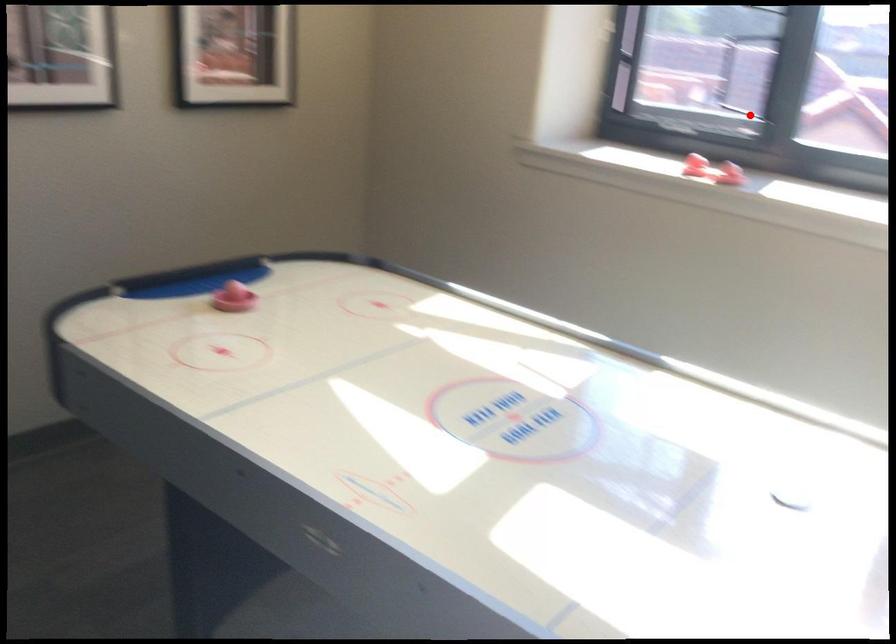
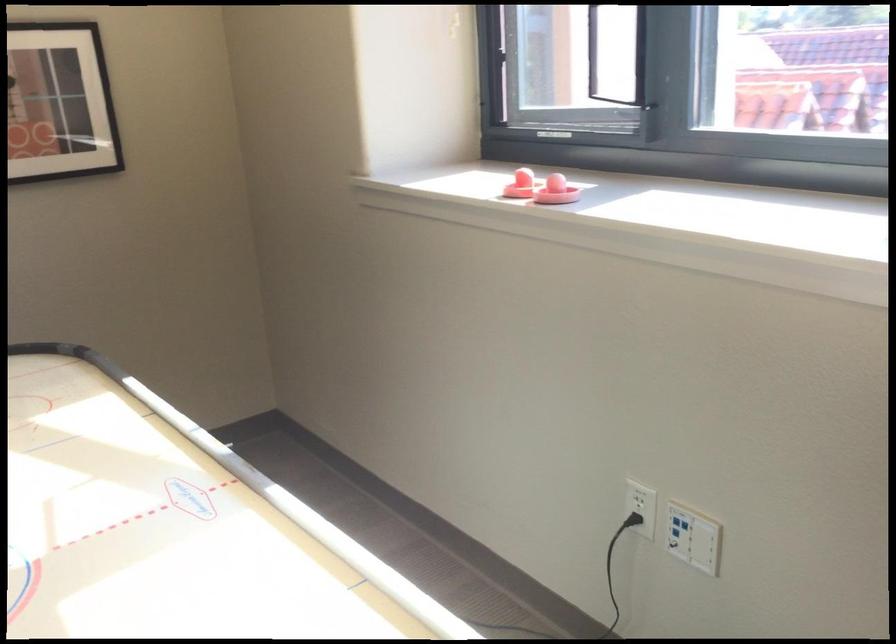
Question: I am providing you with two images of the same scene from different viewpoints. Image1 has a red point marked. In image2, the corresponding 3D location appears at what relative position? Reply with the corresponding letter.

Choices:
 (A) Closer
 (B) Farther

Answer: (A)